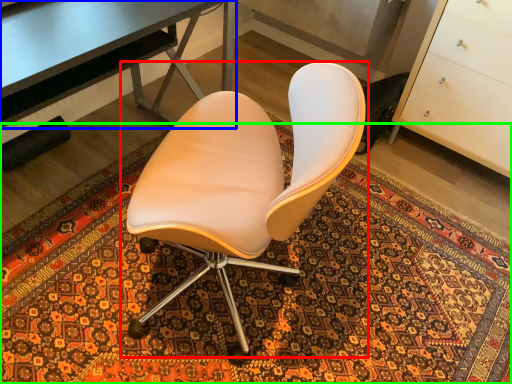
Question: Considering the real-world distances, which object is closest to chair (highlighted by a red box)? desk (highlighted by a blue box) or mat (highlighted by a green box).

Choices:
 (A) desk
 (B) mat

Answer: (A)